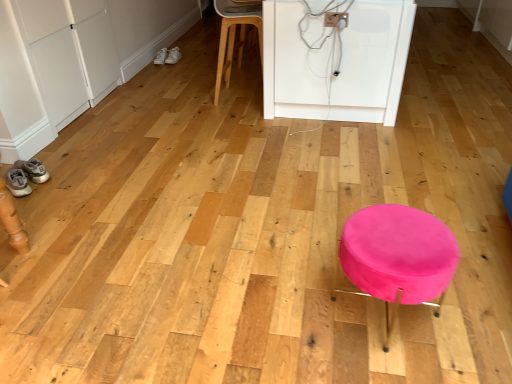
This screenshot has height=384, width=512. Find the location of `light wood stool at center`. light wood stool at center is located at coordinates (234, 34).

This screenshot has height=384, width=512. In order to click on white leather sneakers at upper left, arranged as the 2th footwear when viewed from the front in this screenshot , I will do `click(161, 57)`.

What is the approximate height of matte gray sneakers at lower left, positioned as the 1th footwear in bottom-to-top order?

4.62 inches.

Describe the element at coordinates (173, 56) in the screenshot. I see `white leather sneakers at upper left, which ranks as the first footwear in right-to-left order` at that location.

The image size is (512, 384). What do you see at coordinates (336, 19) in the screenshot?
I see `white plastic electric outlet at upper center` at bounding box center [336, 19].

Where is `light wood stool at center`? The image size is (512, 384). light wood stool at center is located at coordinates (234, 34).

Is matte gray sneakers at lower left, which appears as the third footwear when viewed from the back, inside the boundaries of pink velvet stool at center, or outside?

matte gray sneakers at lower left, which appears as the third footwear when viewed from the back, cannot be found inside pink velvet stool at center.

From a real-world perspective, is matte gray sneakers at lower left, which is the third footwear in top-to-bottom order, above or below pink velvet stool at center?

From a real-world perspective, matte gray sneakers at lower left, which is the third footwear in top-to-bottom order, is physically below pink velvet stool at center.

I want to click on footwear that is the 1st object located behind the pink velvet stool at center, so click(x=17, y=183).

Considering the sizes of objects matte gray sneakers at lower left, positioned as the first footwear in front-to-back order, and pink velvet stool at center in the image provided, who is taller, matte gray sneakers at lower left, positioned as the first footwear in front-to-back order, or pink velvet stool at center?

With more height is pink velvet stool at center.

In the scene shown: Is white leather sneakers at upper left, placed as the 1th footwear when sorted from top to bottom, thinner than white leather sneakers at upper left, arranged as the 2th footwear when viewed from the front?

No, white leather sneakers at upper left, placed as the 1th footwear when sorted from top to bottom, is not thinner than white leather sneakers at upper left, arranged as the 2th footwear when viewed from the front.

From a real-world perspective, count 1st footwears upward from the white leather sneakers at upper left, the 2th footwear positioned from the top, and point to it. Please provide its 2D coordinates.

[(173, 56)]

From a real-world perspective, is white leather sneakers at upper left, which is the third footwear in left-to-right order, above or below white leather sneakers at upper left, acting as the second footwear starting from the left?

In terms of real-world spatial position, white leather sneakers at upper left, which is the third footwear in left-to-right order, is above white leather sneakers at upper left, acting as the second footwear starting from the left.

Between white leather sneakers at upper left, which ranks as the first footwear in back-to-front order, and white leather sneakers at upper left, the second footwear from the bottom, which one appears on the right side from the viewer's perspective?

From the viewer's perspective, white leather sneakers at upper left, which ranks as the first footwear in back-to-front order, appears more on the right side.

Which is less distant, (262,44) or (344,22)?

Point (262,44) appears to be farther away from the viewer than point (344,22).

Considering their positions, is light wood stool at center located in front of or behind white plastic electric outlet at upper center?

In the image, light wood stool at center appears behind white plastic electric outlet at upper center.

Who is smaller, light wood stool at center or white plastic electric outlet at upper center?

With smaller size is white plastic electric outlet at upper center.

What's the angular difference between matte gray sneakers at lower left, positioned as the first footwear in front-to-back order, and light wood stool at center's facing directions?

23.8 degrees.

Looking at their sizes, would you say matte gray sneakers at lower left, which is the third footwear in top-to-bottom order, is wider or thinner than light wood stool at center?

matte gray sneakers at lower left, which is the third footwear in top-to-bottom order, is thinner than light wood stool at center.

Which object is positioned more to the left, matte gray sneakers at lower left, which appears as the first footwear when viewed from the left, or light wood stool at center?

From the viewer's perspective, matte gray sneakers at lower left, which appears as the first footwear when viewed from the left, appears more on the left side.

Is matte gray sneakers at lower left, positioned as the 1th footwear in bottom-to-top order, behind light wood stool at center?

No, matte gray sneakers at lower left, positioned as the 1th footwear in bottom-to-top order, is closer to the viewer.

Is white leather sneakers at upper left, which ranks as the first footwear in right-to-left order, looking in the opposite direction of matte gray sneakers at lower left, positioned as the 1th footwear in bottom-to-top order?

That's not correct — white leather sneakers at upper left, which ranks as the first footwear in right-to-left order, is not looking away from matte gray sneakers at lower left, positioned as the 1th footwear in bottom-to-top order.

Is the position of white leather sneakers at upper left, which ranks as the first footwear in back-to-front order, less distant than that of matte gray sneakers at lower left, positioned as the 3th footwear in right-to-left order?

No, white leather sneakers at upper left, which ranks as the first footwear in back-to-front order, is further to the viewer.

Is white leather sneakers at upper left, which ranks as the first footwear in right-to-left order, spatially inside matte gray sneakers at lower left, positioned as the 1th footwear in bottom-to-top order, or outside of it?

white leather sneakers at upper left, which ranks as the first footwear in right-to-left order, is located beyond the bounds of matte gray sneakers at lower left, positioned as the 1th footwear in bottom-to-top order.

Considering the positions of objects white leather sneakers at upper left, placed as the 1th footwear when sorted from top to bottom, and matte gray sneakers at lower left, positioned as the 1th footwear in bottom-to-top order, in the image provided, who is more to the right, white leather sneakers at upper left, placed as the 1th footwear when sorted from top to bottom, or matte gray sneakers at lower left, positioned as the 1th footwear in bottom-to-top order,?

From the viewer's perspective, white leather sneakers at upper left, placed as the 1th footwear when sorted from top to bottom, appears more on the right side.

Is white plastic electric outlet at upper center in contact with matte gray sneakers at lower left, which is the third footwear in top-to-bottom order?

No, white plastic electric outlet at upper center is not with matte gray sneakers at lower left, which is the third footwear in top-to-bottom order.

Consider the image. From the image's perspective, would you say white plastic electric outlet at upper center is positioned over matte gray sneakers at lower left, positioned as the 3th footwear in right-to-left order?

Yes, from the image's perspective, white plastic electric outlet at upper center is over matte gray sneakers at lower left, positioned as the 3th footwear in right-to-left order.

What's the angular difference between white plastic electric outlet at upper center and matte gray sneakers at lower left, which is the third footwear in top-to-bottom order,'s facing directions?

The angular difference between white plastic electric outlet at upper center and matte gray sneakers at lower left, which is the third footwear in top-to-bottom order, is 66.2 degrees.

Is matte gray sneakers at lower left, positioned as the 1th footwear in bottom-to-top order, at the back of white plastic electric outlet at upper center?

No, matte gray sneakers at lower left, positioned as the 1th footwear in bottom-to-top order, is not at the back of white plastic electric outlet at upper center.

From a real-world perspective, which object rests below the other?

light wood stool at center.

Is point (337, 22) closer to camera compared to point (227, 32)?

Yes.

Which object is positioned more to the left, white plastic electric outlet at upper center or light wood stool at center?

light wood stool at center.

You are a GUI agent. You are given a task and a screenshot of the screen. Output one action in this format:
    pyautogui.click(x=<x>, y=<y>)
    Task: Click on the electric outlet on the right side of light wood stool at center
    
    Given the screenshot: What is the action you would take?
    pyautogui.click(x=336, y=19)

At what (x,y) coordinates should I click in order to perform the action: click on furniture that is on the right side of matte gray sneakers at lower left, which appears as the first footwear when viewed from the left. Please return your answer as a coordinate pair (x, y). The height and width of the screenshot is (384, 512). Looking at the image, I should click on (398, 257).

This screenshot has width=512, height=384. Find the location of `footwear that is above the white leather sneakers at upper left, the second footwear in the back-to-front sequence (from the image's perspective)`. footwear that is above the white leather sneakers at upper left, the second footwear in the back-to-front sequence (from the image's perspective) is located at coordinates (173, 56).

Which object lies further to the anchor point white leather sneakers at upper left, the second footwear viewed from the right, pink velvet stool at center or matte gray sneakers at lower left, positioned as the 1th footwear in bottom-to-top order?

Based on the image, pink velvet stool at center appears to be further to white leather sneakers at upper left, the second footwear viewed from the right.

From the image, which object appears to be farther from white plastic electric outlet at upper center, matte gray sneakers at lower left, positioned as the 3th footwear in right-to-left order, or light wood stool at center?

matte gray sneakers at lower left, positioned as the 3th footwear in right-to-left order, is further to white plastic electric outlet at upper center.

Which object lies further to the anchor point matte gray sneakers at lower left, which is the third footwear in top-to-bottom order, white plastic electric outlet at upper center or pink velvet stool at center?

Among the two, white plastic electric outlet at upper center is located further to matte gray sneakers at lower left, which is the third footwear in top-to-bottom order.

Based on their spatial positions, is white leather sneakers at upper left, the second footwear from the bottom, or light wood stool at center further from white plastic electric outlet at upper center?

white leather sneakers at upper left, the second footwear from the bottom, is positioned further to the anchor white plastic electric outlet at upper center.

Considering their positions, is light wood stool at center positioned closer to white leather sneakers at upper left, which is the third footwear in left-to-right order, than white plastic electric outlet at upper center?

Based on the image, light wood stool at center appears to be nearer to white leather sneakers at upper left, which is the third footwear in left-to-right order.

Which object lies nearer to the anchor point pink velvet stool at center, light wood stool at center or white leather sneakers at upper left, the second footwear in the back-to-front sequence?

The object closer to pink velvet stool at center is light wood stool at center.

Based on their spatial positions, is matte gray sneakers at lower left, positioned as the first footwear in front-to-back order, or white leather sneakers at upper left, the second footwear from the bottom, closer to white leather sneakers at upper left, which is the third footwear in left-to-right order?

white leather sneakers at upper left, the second footwear from the bottom, lies closer to white leather sneakers at upper left, which is the third footwear in left-to-right order, than the other object.

Estimate the real-world distances between objects in this image. Which object is closer to light wood stool at center, pink velvet stool at center or white leather sneakers at upper left, which is the third footwear in left-to-right order?

white leather sneakers at upper left, which is the third footwear in left-to-right order, lies closer to light wood stool at center than the other object.

This screenshot has width=512, height=384. I want to click on chair positioned between white plastic electric outlet at upper center and white leather sneakers at upper left, which ranks as the first footwear in right-to-left order, from near to far, so click(234, 34).

Identify the location of electric outlet located between pink velvet stool at center and white leather sneakers at upper left, which ranks as the first footwear in back-to-front order, in the depth direction. (336, 19).

The image size is (512, 384). Identify the location of electric outlet positioned between pink velvet stool at center and white leather sneakers at upper left, the second footwear from the bottom, from near to far. (336, 19).

Locate an element on the screen. This screenshot has width=512, height=384. electric outlet positioned between pink velvet stool at center and light wood stool at center from near to far is located at coordinates (336, 19).